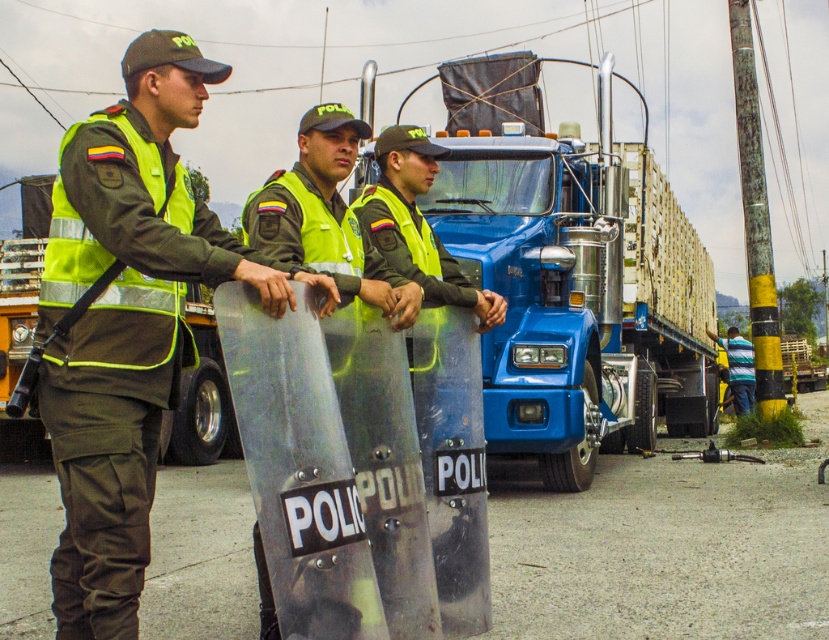
You are a photographer trying to capture a clear photo of the blue metallic truck at center and the green matte uniform at left. Since you want the truck to be the main focus, which object should you adjust your camera to focus on first, considering their positions?

The blue metallic truck at center is closer to you than the green matte uniform at left, so you should focus on the blue metallic truck at center first to ensure it appears sharp and in focus.

You are a drone operator trying to capture a clear aerial photo of the police officers and the truck. You need to position your drone so that both points marked as point (611,220) and point (114,278) are visible in the frame. Based on their positions, which point should be closer to the back of the image to ensure both are in view?

Point (611,220) is behind point (114,278), so it should be positioned closer to the back of the image to ensure both points are visible.

You are a photographer trying to capture a clear shot of both the green matte uniform at left and the green reflective vest at center. Since you want both subjects in focus, which one should you focus on first to ensure depth of field covers both?

You should focus on the green matte uniform at left first because it is closer to the viewer than the green reflective vest at center, so setting focus on the closer object will ensure the depth of field extends to the farther one.